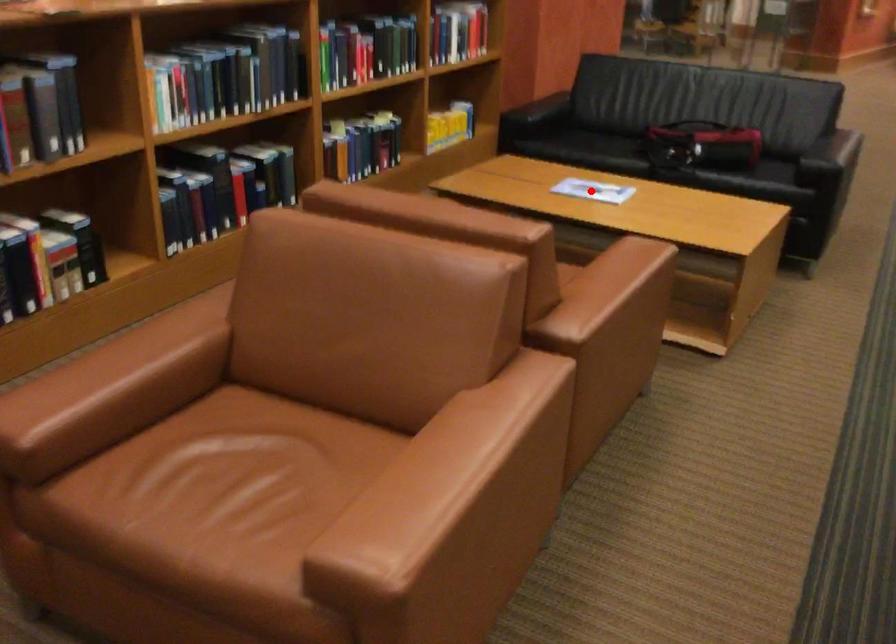
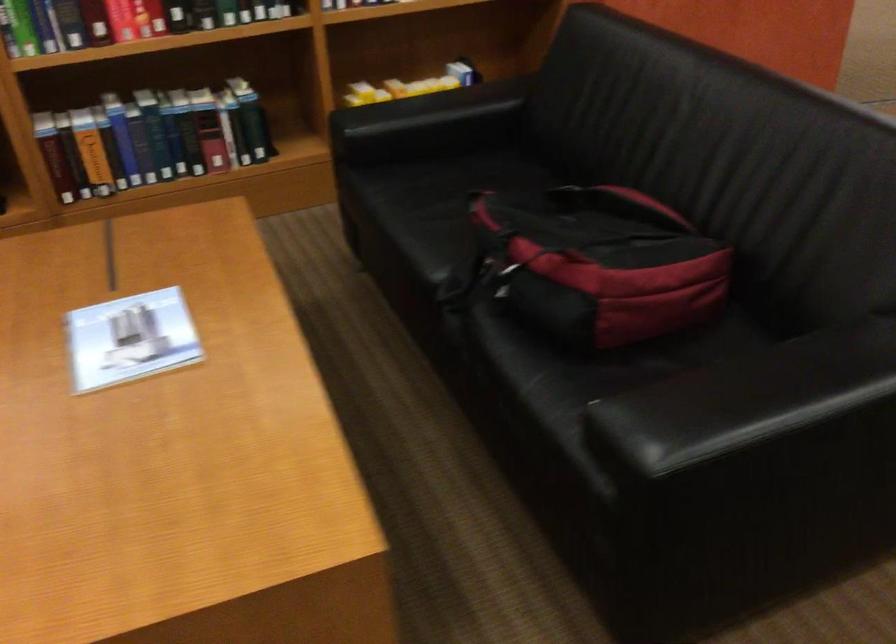
Where in the second image is the point corresponding to the highlighted location from the first image?

(131, 339)